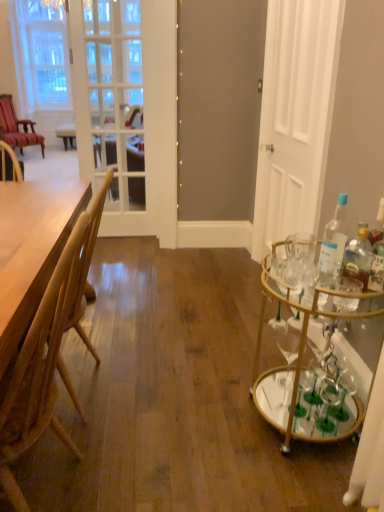
Where is `wooden table at left`? The height and width of the screenshot is (512, 384). wooden table at left is located at coordinates (31, 249).

Identify the location of velvet red armchair at left, acting as the second chair starting from the right. This screenshot has height=512, width=384. (17, 127).

Describe the element at coordinates (39, 371) in the screenshot. I see `light brown wood chair at left, marked as the 2th chair in a left-to-right arrangement` at that location.

How much space does light brown wood chair at left, marked as the 2th chair in a left-to-right arrangement, occupy vertically?

light brown wood chair at left, marked as the 2th chair in a left-to-right arrangement, is 38.18 inches tall.

Where is `white matte door at right`? The image size is (384, 512). white matte door at right is located at coordinates (295, 117).

Can you tell me how much gold mirrored bar cart at right and light brown wood chair at left, which appears as the second chair when viewed from the top, differ in facing direction?

2.09 degrees.

Could you tell me if gold mirrored bar cart at right is turned towards light brown wood chair at left, which appears as the second chair when viewed from the top?

Yes, gold mirrored bar cart at right is facing light brown wood chair at left, which appears as the second chair when viewed from the top.

Which is in front, gold mirrored bar cart at right or light brown wood chair at left, which appears as the second chair when viewed from the top?

Positioned in front is light brown wood chair at left, which appears as the second chair when viewed from the top.

From the image's perspective, is gold mirrored bar cart at right located beneath light brown wood chair at left, which is the first chair from front to back?

Incorrect, from the image's perspective, gold mirrored bar cart at right is higher than light brown wood chair at left, which is the first chair from front to back.

Is white glass screen door at upper left oriented away from gold mirrored bar cart at right?

No, gold mirrored bar cart at right is not at the back of white glass screen door at upper left.

Does white glass screen door at upper left come in front of gold mirrored bar cart at right?

No, white glass screen door at upper left is further to the viewer.

Locate an element on the screen. The image size is (384, 512). shelf lying below the white glass screen door at upper left (from the image's perspective) is located at coordinates (302, 339).

Which of these two, white glass screen door at upper left or gold mirrored bar cart at right, is bigger?

Bigger between the two is gold mirrored bar cart at right.

Considering the relative sizes of clear glass bottle at right, the 1th bottle when ordered from left to right, and clear glass bottle at right, acting as the second bottle starting from the left, in the image provided, is clear glass bottle at right, the 1th bottle when ordered from left to right, shorter than clear glass bottle at right, acting as the second bottle starting from the left,?

No, clear glass bottle at right, the 1th bottle when ordered from left to right, is not shorter than clear glass bottle at right, acting as the second bottle starting from the left.

Considering the relative positions of clear glass bottle at right, the 1th bottle when ordered from left to right, and clear glass bottle at right, positioned as the first bottle in right-to-left order, in the image provided, is clear glass bottle at right, the 1th bottle when ordered from left to right, to the left of clear glass bottle at right, positioned as the first bottle in right-to-left order, from the viewer's perspective?

Indeed, clear glass bottle at right, the 1th bottle when ordered from left to right, is positioned on the left side of clear glass bottle at right, positioned as the first bottle in right-to-left order.

Is clear glass bottle at right, arranged as the 2th bottle when viewed from the right, not inside clear glass bottle at right, positioned as the first bottle in right-to-left order?

Yes.

Is point (340, 252) farther from viewer compared to point (361, 280)?

That is True.

Locate an element on the screen. table on the left of white matte door at right is located at coordinates (31, 249).

Is the position of wooden table at left more distant than that of white matte door at right?

No.

Considering the relative sizes of wooden table at left and white matte door at right in the image provided, is wooden table at left shorter than white matte door at right?

Indeed, wooden table at left has a lesser height compared to white matte door at right.

Does point (27, 271) lie in front of point (296, 98)?

That is True.

Is white matte door at right oriented towards white glass screen door at upper left?

No, white matte door at right does not turn towards white glass screen door at upper left.

Which of these two, white matte door at right or white glass screen door at upper left, is wider?

white matte door at right is wider.

Does white matte door at right lie behind white glass screen door at upper left?

No, white matte door at right is in front of white glass screen door at upper left.

Is point (305, 206) closer to viewer compared to point (127, 157)?

Yes, point (305, 206) is in front of point (127, 157).

Between velvet red armchair at left, marked as the 2th chair in a bottom-to-top arrangement, and white glass screen door at upper left, which one appears on the left side from the viewer's perspective?

velvet red armchair at left, marked as the 2th chair in a bottom-to-top arrangement.

How distant is velvet red armchair at left, marked as the second chair in a front-to-back arrangement, from white glass screen door at upper left?

velvet red armchair at left, marked as the second chair in a front-to-back arrangement, is 6.89 feet from white glass screen door at upper left.

Is velvet red armchair at left, marked as the 2th chair in a bottom-to-top arrangement, oriented towards white glass screen door at upper left?

Yes, velvet red armchair at left, marked as the 2th chair in a bottom-to-top arrangement, is turned towards white glass screen door at upper left.

Can you confirm if white matte door at right is thinner than light brown wood chair at left, which appears as the second chair when viewed from the top?

Yes, white matte door at right is thinner than light brown wood chair at left, which appears as the second chair when viewed from the top.

From a real-world perspective, which is physically above, white matte door at right or light brown wood chair at left, which appears as the second chair when viewed from the top?

In real-world perspective, white matte door at right is above.

Which is in front, point (324, 21) or point (41, 328)?

The point (41, 328) is more forward.

Which chair is the 1st one when counting from the left side of the gold mirrored bar cart at right? Please provide its 2D coordinates.

[(39, 371)]

This screenshot has width=384, height=512. What are the coordinates of `screen door above the gold mirrored bar cart at right (from a real-world perspective)` in the screenshot? It's located at pos(110,105).

Estimate the real-world distances between objects in this image. Which object is closer to white glass screen door at upper left, velvet red armchair at left, acting as the second chair starting from the right, or clear glass bottle at right, acting as the second bottle starting from the left?

velvet red armchair at left, acting as the second chair starting from the right, is positioned closer to the anchor white glass screen door at upper left.

When comparing their distances from white matte door at right, does wooden table at left or velvet red armchair at left, the first chair when ordered from top to bottom, seem further?

velvet red armchair at left, the first chair when ordered from top to bottom.

Which object lies nearer to the anchor point wooden table at left, clear glass bottle at right, the 1th bottle when ordered from left to right, or light brown wood chair at left, marked as the first chair in a right-to-left arrangement?

light brown wood chair at left, marked as the first chair in a right-to-left arrangement, is closer to wooden table at left.

When comparing their distances from white glass screen door at upper left, does clear glass bottle at right, the 1th bottle when ordered from left to right, or light brown wood chair at left, which is the first chair from front to back, seem closer?

light brown wood chair at left, which is the first chair from front to back, is closer to white glass screen door at upper left.

Considering their positions, is clear glass bottle at right, acting as the second bottle starting from the left, positioned further to white matte door at right than light brown wood chair at left, marked as the first chair in a right-to-left arrangement?

Among the two, light brown wood chair at left, marked as the first chair in a right-to-left arrangement, is located further to white matte door at right.

Considering their positions, is white glass screen door at upper left positioned further to velvet red armchair at left, acting as the second chair starting from the right, than wooden table at left?

Among the two, wooden table at left is located further to velvet red armchair at left, acting as the second chair starting from the right.

From the image, which object appears to be farther from white glass screen door at upper left, gold mirrored bar cart at right or clear glass bottle at right, the 1th bottle when ordered from left to right?

clear glass bottle at right, the 1th bottle when ordered from left to right, lies further to white glass screen door at upper left than the other object.

Which object lies further to the anchor point wooden table at left, light brown wood chair at left, which is the 1th chair from bottom to top, or white glass screen door at upper left?

Based on the image, white glass screen door at upper left appears to be further to wooden table at left.

The height and width of the screenshot is (512, 384). I want to click on door between light brown wood chair at left, marked as the 2th chair in a left-to-right arrangement, and velvet red armchair at left, which is counted as the 1th chair, starting from the back, along the z-axis, so click(x=295, y=117).

The width and height of the screenshot is (384, 512). I want to click on screen door between light brown wood chair at left, which is the 1th chair from bottom to top, and velvet red armchair at left, positioned as the 1th chair in left-to-right order, from front to back, so click(x=110, y=105).

The width and height of the screenshot is (384, 512). Identify the location of bottle between white matte door at right and clear glass bottle at right, acting as the second bottle starting from the left, in the vertical direction. (333, 243).

Identify the location of bottle between clear glass bottle at right, the 1th bottle when ordered from left to right, and gold mirrored bar cart at right vertically. (358, 256).